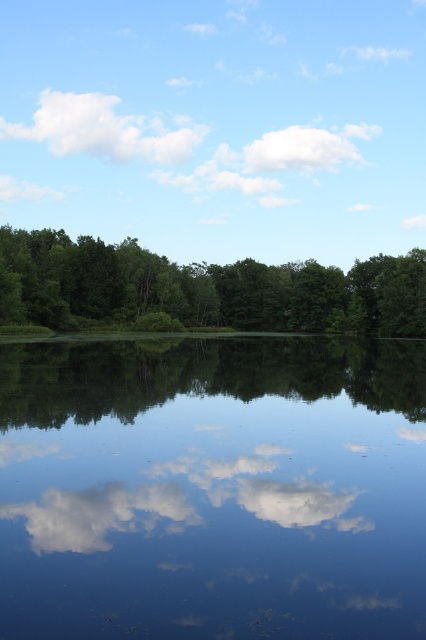
You are a surveyor measuring the distance between two landmarks in this landscape. You have a measuring tape that can only extend up to 70 meters. If you need to measure the distance between the transparent blue water at center and the green leafy forest at center, will your measuring tape be sufficient?

The transparent blue water at center and green leafy forest at center are 72.66 meters apart. Since the measuring tape can only extend up to 70 meters, it will not be sufficient to measure the distance between them.

You are standing on the lakeside and looking at the green leafy forest at center and the white fluffy cloud at upper left. Which object appears closer to you?

The green leafy forest at center is closer to the viewer than the white fluffy cloud at upper left.